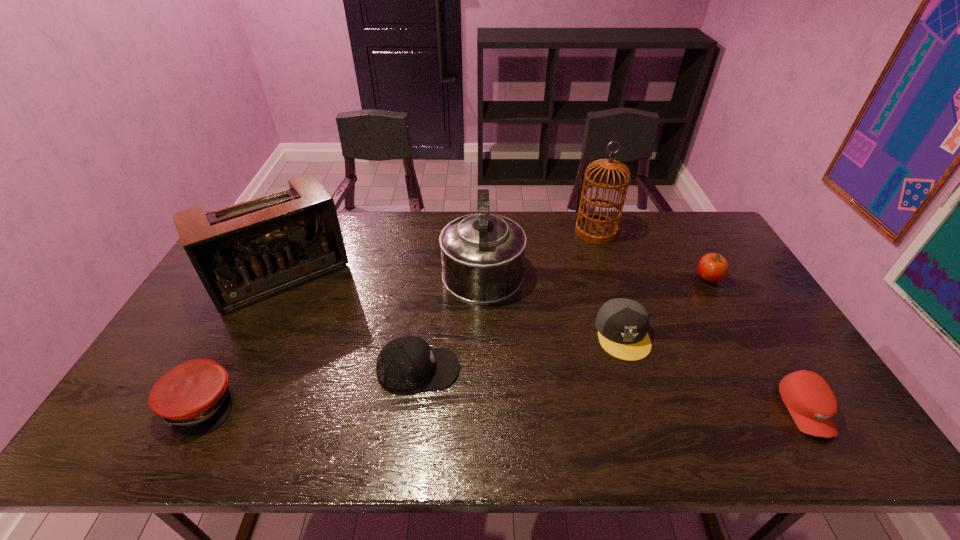
At what (x,y) coordinates should I click in order to perform the action: click on vacant area located 0.220m on the right of the radio receiver. Please return your answer as a coordinate pair (x, y). Image resolution: width=960 pixels, height=540 pixels. Looking at the image, I should click on (416, 276).

You are a GUI agent. You are given a task and a screenshot of the screen. Output one action in this format:
    pyautogui.click(x=<x>, y=<y>)
    Task: Click on the blank area located on the left of the fifth shortest object
    This screenshot has height=540, width=960.
    Given the screenshot: What is the action you would take?
    pyautogui.click(x=644, y=279)

At what (x,y) coordinates should I click in order to perform the action: click on vacant space located on the front-facing side of the second cap from left to right. Please return your answer as a coordinate pair (x, y). The image size is (960, 540). Looking at the image, I should click on pos(497,369).

Locate an element on the screen. The width and height of the screenshot is (960, 540). free region located on the front-facing side of the third cap from left to right is located at coordinates (641, 394).

This screenshot has width=960, height=540. Identify the location of free space located 0.380m at the front of the leftmost cap where the visor is located. (391, 404).

You are a GUI agent. You are given a task and a screenshot of the screen. Output one action in this format:
    pyautogui.click(x=<x>, y=<y>)
    Task: Click on the birdcage positioned at the far edge
    The height and width of the screenshot is (540, 960).
    Given the screenshot: What is the action you would take?
    pyautogui.click(x=594, y=228)

At what (x,y) coordinates should I click in order to perform the action: click on kettle located at the far edge. Please return your answer as a coordinate pair (x, y). The width and height of the screenshot is (960, 540). Looking at the image, I should click on [x=482, y=255].

Locate an element on the screen. The image size is (960, 540). radio receiver that is at the far edge is located at coordinates (247, 252).

What are the coordinates of `radio receiver at the left edge` in the screenshot? It's located at (247, 252).

Identify the location of cap that is at the left edge. (194, 397).